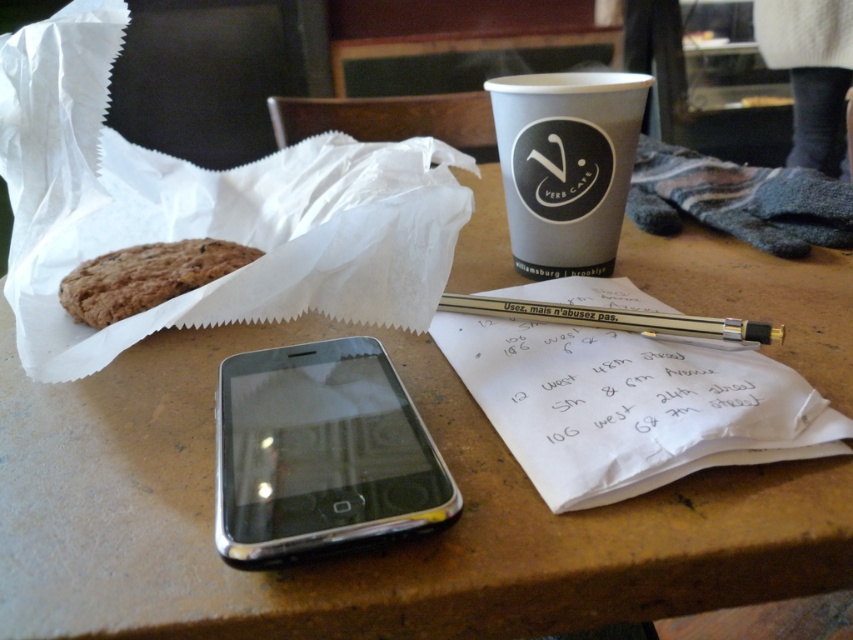
You are a delivery robot with a height of 22 inches. You need to deliver a package to the table. The delivery point is at coordinate point (527, 268). Can you reach the delivery point without hitting your head?

The distance of point (527, 268) from camera is 21.87 inches, so the delivery robot cannot reach the delivery point as it would hit its head since the robot is taller than the available space.

You are holding a camera and want to take a photo of the point at coordinates (x=606, y=124). The camera is currently 49.63 centimeters away from the point. If the camera needs to be exactly 50 centimeters away to focus properly, should you move closer or farther away?

The camera is currently 49.63 centimeters away from the point, which is slightly closer than the required 50 centimeters. To achieve proper focus, you should move the camera slightly farther away from the point to increase the distance to exactly 50 centimeters.